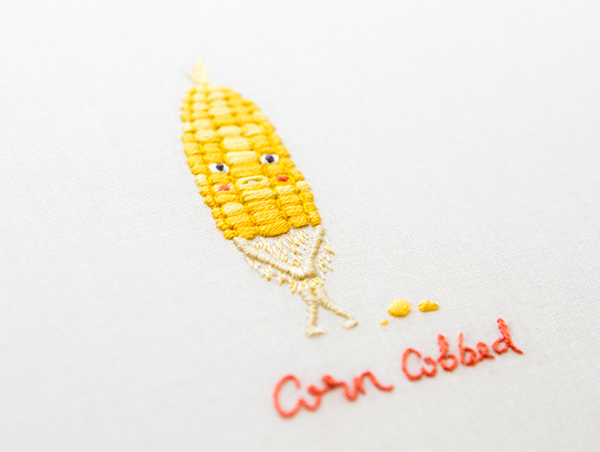
Locate an element on the screen. This screenshot has height=452, width=600. floor is located at coordinates (151, 318), (427, 222).